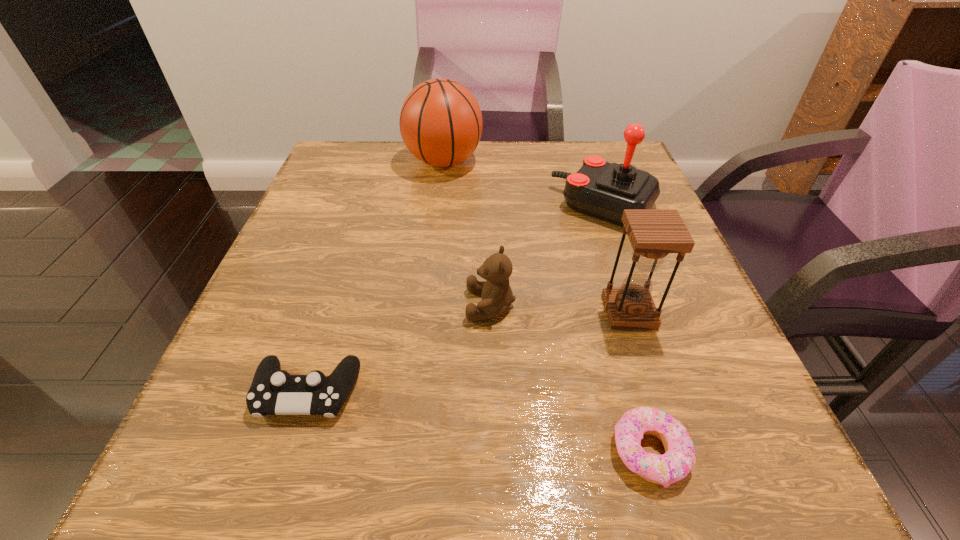
I want to click on free space located 0.270m on the front-facing side of the third shortest object, so click(307, 305).

The image size is (960, 540). I want to click on vacant space situated 0.200m on the front-facing side of the third shortest object, so (x=348, y=305).

This screenshot has height=540, width=960. What are the coordinates of `vacant space situated on the surface of the control` in the screenshot? It's located at (279, 477).

Where is `vacant area situated on the back of the shortest object`? vacant area situated on the back of the shortest object is located at coordinates (600, 275).

In order to click on basketball that is at the far edge in this screenshot , I will do `click(441, 123)`.

This screenshot has width=960, height=540. I want to click on joystick situated at the far edge, so click(x=604, y=190).

The height and width of the screenshot is (540, 960). I want to click on object that is at the near edge, so click(679, 459).

Where is `object that is positioned at the left edge`? The width and height of the screenshot is (960, 540). object that is positioned at the left edge is located at coordinates (273, 391).

This screenshot has width=960, height=540. What are the coordinates of `joystick at the right edge` in the screenshot? It's located at (604, 190).

What are the coordinates of `hourglass that is at the right edge` in the screenshot? It's located at (653, 233).